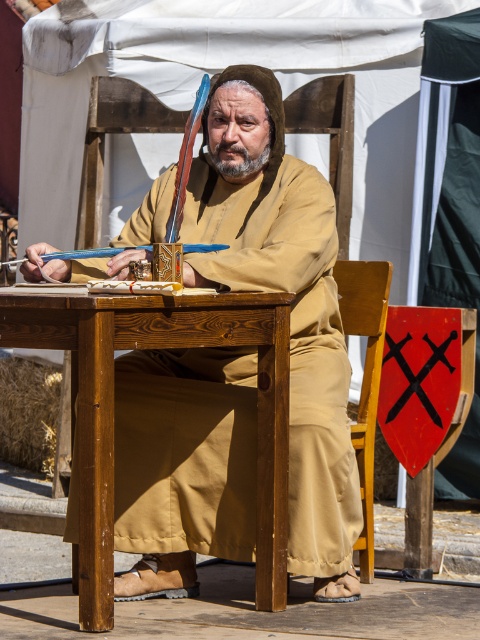
You are a medieval scribe who needs to adjust your workspace. You have a wooden table at center and a wooden chair at center. Which object should you lower to ensure comfortable writing posture?

The wooden table at center is not as tall as the wooden chair at center, so you should lower the wooden table at center to achieve a comfortable writing posture.

Looking at this image, you are a painter who wants to sketch the scene. You notice the brown clothed man at center and the wooden chair at center. Which object should you draw first if you want to focus on the larger one?

The brown clothed man at center is bigger than the wooden chair at center, so you should draw the brown clothed man at center first.

What is located at the point with coordinates (283, 291) in the image?

The brown clothed man at center is located at point (283, 291).